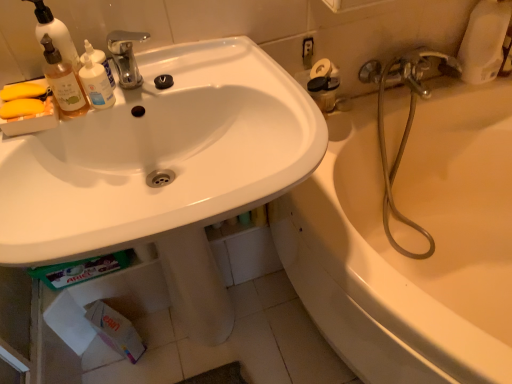
Find the location of a particular element. Image resolution: width=512 pixels, height=384 pixels. translucent plastic bottle at upper left is located at coordinates (98, 60).

The width and height of the screenshot is (512, 384). Find the location of `white matte soap dispenser at upper left`. white matte soap dispenser at upper left is located at coordinates (55, 33).

The width and height of the screenshot is (512, 384). I want to click on metallic hose at right, acting as the second plumbing fixture starting from the back, so click(405, 125).

What do you see at coordinates (405, 125) in the screenshot?
I see `metallic hose at right, acting as the second plumbing fixture starting from the back` at bounding box center [405, 125].

Identify the location of satin nickel faucet at upper right, which is the first plumbing fixture in back-to-front order. (408, 70).

Identify the location of translucent plastic bottle at upper left. (98, 60).

Can you confirm if white glossy sink at upper left is thinner than metallic hose at right, the first plumbing fixture viewed from the front?

Incorrect, the width of white glossy sink at upper left is not less than that of metallic hose at right, the first plumbing fixture viewed from the front.

Which of these two, white glossy sink at upper left or metallic hose at right, the first plumbing fixture viewed from the front, stands shorter?

With less height is metallic hose at right, the first plumbing fixture viewed from the front.

How far apart are white glossy sink at upper left and metallic hose at right, the first plumbing fixture viewed from the front?

A distance of 23.55 inches exists between white glossy sink at upper left and metallic hose at right, the first plumbing fixture viewed from the front.

Considering the positions of points (40, 155) and (362, 77), is point (40, 155) farther from camera compared to point (362, 77)?

No, (40, 155) is closer to viewer.

Considering the relative sizes of satin nickel faucet at upper right, which is the first plumbing fixture in back-to-front order, and translucent plastic bottle at upper left in the image provided, is satin nickel faucet at upper right, which is the first plumbing fixture in back-to-front order, thinner than translucent plastic bottle at upper left?

Incorrect, the width of satin nickel faucet at upper right, which is the first plumbing fixture in back-to-front order, is not less than that of translucent plastic bottle at upper left.

Is satin nickel faucet at upper right, which is the first plumbing fixture in back-to-front order, to the right of translucent plastic bottle at upper left from the viewer's perspective?

Yes.

Does satin nickel faucet at upper right, which is the first plumbing fixture in back-to-front order, turn towards translucent plastic bottle at upper left?

No, satin nickel faucet at upper right, which is the first plumbing fixture in back-to-front order, is not oriented towards translucent plastic bottle at upper left.

From a real-world perspective, which object stands above the other?

In real-world perspective, translucent plastic bottle at upper left is above.

Can white matte soap dispenser at upper left be found inside translucent glass bottle at upper left?

No.

From the image's perspective, which is below, translucent glass bottle at upper left or white matte soap dispenser at upper left?

From the image's view, translucent glass bottle at upper left is below.

From a real-world perspective, is translucent glass bottle at upper left located beneath white matte soap dispenser at upper left?

Yes.

Which is in front, point (47, 60) or point (77, 60)?

The point (77, 60) is more forward.

I want to click on cleaning product in front of the satin nickel faucet at upper right, which is the first plumbing fixture in back-to-front order, so click(x=98, y=60).

Is translucent plastic bottle at upper left touching satin nickel faucet at upper right, which is the first plumbing fixture in back-to-front order?

They are not placed beside each other.

Can you confirm if translucent plastic bottle at upper left is taller than satin nickel faucet at upper right, placed as the 2th plumbing fixture when sorted from front to back?

In fact, translucent plastic bottle at upper left may be shorter than satin nickel faucet at upper right, placed as the 2th plumbing fixture when sorted from front to back.

Which is correct: translucent plastic bottle at upper left is inside satin nickel faucet at upper right, placed as the 2th plumbing fixture when sorted from front to back, or outside of it?

translucent plastic bottle at upper left is not enclosed by satin nickel faucet at upper right, placed as the 2th plumbing fixture when sorted from front to back.

Is polished chrome faucet at upper center thinner than translucent glass bottle at upper left?

No, polished chrome faucet at upper center is not thinner than translucent glass bottle at upper left.

Based on the photo, is polished chrome faucet at upper center to the left or to the right of translucent glass bottle at upper left in the image?

polished chrome faucet at upper center is to the right of translucent glass bottle at upper left.

You are a GUI agent. You are given a task and a screenshot of the screen. Output one action in this format:
    pyautogui.click(x=<x>, y=<y>)
    Task: Click on the bottle above the polished chrome faucet at upper center (from a real-world perspective)
    
    Given the screenshot: What is the action you would take?
    pyautogui.click(x=63, y=81)

Can you see polished chrome faucet at upper center touching translucent glass bottle at upper left?

No, polished chrome faucet at upper center is not next to translucent glass bottle at upper left.

Would you say metallic hose at right, acting as the second plumbing fixture starting from the back, is outside satin nickel faucet at upper right, placed as the 2th plumbing fixture when sorted from front to back?

Yes, metallic hose at right, acting as the second plumbing fixture starting from the back, is located beyond the bounds of satin nickel faucet at upper right, placed as the 2th plumbing fixture when sorted from front to back.

Does metallic hose at right, the first plumbing fixture viewed from the front, turn towards satin nickel faucet at upper right, which is the first plumbing fixture in back-to-front order?

No, metallic hose at right, the first plumbing fixture viewed from the front, is not oriented towards satin nickel faucet at upper right, which is the first plumbing fixture in back-to-front order.

Considering the relative sizes of metallic hose at right, the first plumbing fixture viewed from the front, and satin nickel faucet at upper right, which is the first plumbing fixture in back-to-front order, in the image provided, is metallic hose at right, the first plumbing fixture viewed from the front, smaller than satin nickel faucet at upper right, which is the first plumbing fixture in back-to-front order,?

Actually, metallic hose at right, the first plumbing fixture viewed from the front, might be larger than satin nickel faucet at upper right, which is the first plumbing fixture in back-to-front order.

Does white matte toilet paper at lower left have a lesser width compared to translucent glass bottle at upper left?

In fact, white matte toilet paper at lower left might be wider than translucent glass bottle at upper left.

Considering the positions of points (110, 317) and (71, 96), is point (110, 317) farther from camera compared to point (71, 96)?

That is True.

Is white matte toilet paper at lower left turned away from translucent glass bottle at upper left?

No, white matte toilet paper at lower left's orientation is not away from translucent glass bottle at upper left.

Is white matte toilet paper at lower left not near translucent glass bottle at upper left?

That's not correct — white matte toilet paper at lower left is a little close to translucent glass bottle at upper left.

Identify the location of sink located on the left of metallic hose at right, acting as the second plumbing fixture starting from the back. Image resolution: width=512 pixels, height=384 pixels. (160, 156).

Identify the location of plumbing fixture above the translucent plastic bottle at upper left (from the image's perspective). (408, 70).

Looking at the image, which one is located further to translucent plastic bottle at upper left, satin nickel faucet at upper right, placed as the 2th plumbing fixture when sorted from front to back, or white matte soap dispenser at upper left?

satin nickel faucet at upper right, placed as the 2th plumbing fixture when sorted from front to back, lies further to translucent plastic bottle at upper left than the other object.

Which object lies further to the anchor point translucent glass bottle at upper left, translucent plastic bottle at upper left or satin nickel faucet at upper right, placed as the 2th plumbing fixture when sorted from front to back?

Among the two, satin nickel faucet at upper right, placed as the 2th plumbing fixture when sorted from front to back, is located further to translucent glass bottle at upper left.

Which object lies nearer to the anchor point polished chrome faucet at upper center, translucent glass bottle at upper left or white matte toilet paper at lower left?

Based on the image, translucent glass bottle at upper left appears to be nearer to polished chrome faucet at upper center.

Considering their positions, is translucent plastic bottle at upper left positioned closer to metallic hose at right, the first plumbing fixture viewed from the front, than polished chrome faucet at upper center?

polished chrome faucet at upper center.

When comparing their distances from translucent glass bottle at upper left, does white glossy sink at upper left or polished chrome faucet at upper center seem closer?

Based on the image, polished chrome faucet at upper center appears to be nearer to translucent glass bottle at upper left.

When comparing their distances from translucent glass bottle at upper left, does white matte soap dispenser at upper left or metallic hose at right, acting as the second plumbing fixture starting from the back, seem further?

Based on the image, metallic hose at right, acting as the second plumbing fixture starting from the back, appears to be further to translucent glass bottle at upper left.

When comparing their distances from white glossy bathtub at right, does translucent plastic bottle at upper left or white matte soap dispenser at upper left seem closer?

The object closer to white glossy bathtub at right is translucent plastic bottle at upper left.

From the picture: Considering their positions, is satin nickel faucet at upper right, which is the first plumbing fixture in back-to-front order, positioned closer to white matte soap dispenser at upper left than white glossy bathtub at right?

Based on the image, satin nickel faucet at upper right, which is the first plumbing fixture in back-to-front order, appears to be nearer to white matte soap dispenser at upper left.

You are a GUI agent. You are given a task and a screenshot of the screen. Output one action in this format:
    pyautogui.click(x=<x>, y=<y>)
    Task: Click on the sink between translucent plastic bottle at upper left and satin nickel faucet at upper right, placed as the 2th plumbing fixture when sorted from front to back, from left to right
    The width and height of the screenshot is (512, 384).
    Given the screenshot: What is the action you would take?
    pyautogui.click(x=160, y=156)

Locate an element on the screen. Image resolution: width=512 pixels, height=384 pixels. tap between white matte toilet paper at lower left and satin nickel faucet at upper right, placed as the 2th plumbing fixture when sorted from front to back, from left to right is located at coordinates (126, 56).

Find the location of a particular element. cleaning product between translucent glass bottle at upper left and polished chrome faucet at upper center in the horizontal direction is located at coordinates (98, 60).

The image size is (512, 384). In order to click on cleaning product situated between white matte soap dispenser at upper left and white glossy bathtub at right from left to right in this screenshot , I will do `click(98, 60)`.